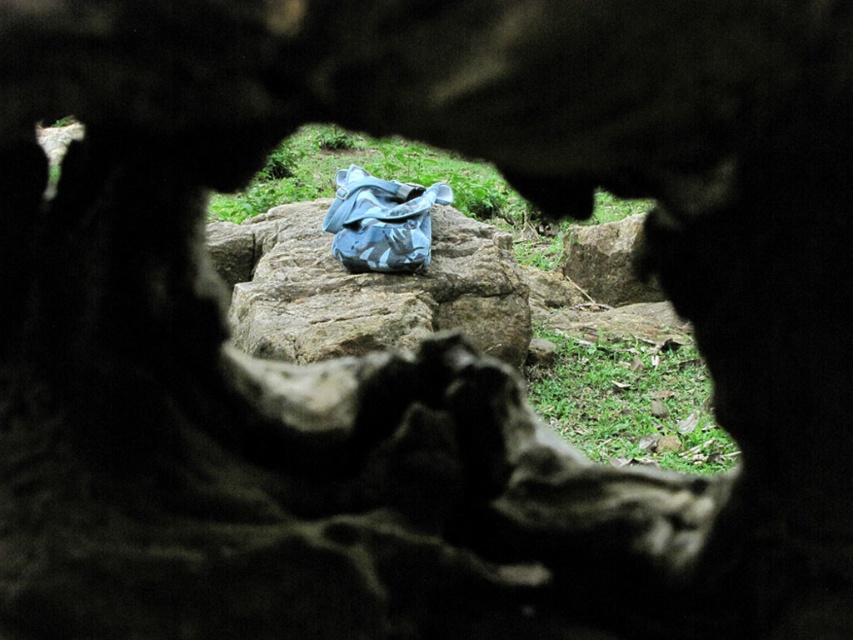
Is point (235, 236) farther from camera compared to point (368, 209)?

Yes, point (235, 236) is farther from viewer.

This screenshot has height=640, width=853. What do you see at coordinates (364, 289) in the screenshot?
I see `rough textured rock at center` at bounding box center [364, 289].

Is point (494, 230) closer to viewer compared to point (346, 224)?

No, (494, 230) is behind (346, 224).

Where is `rough textured rock at center`? rough textured rock at center is located at coordinates (364, 289).